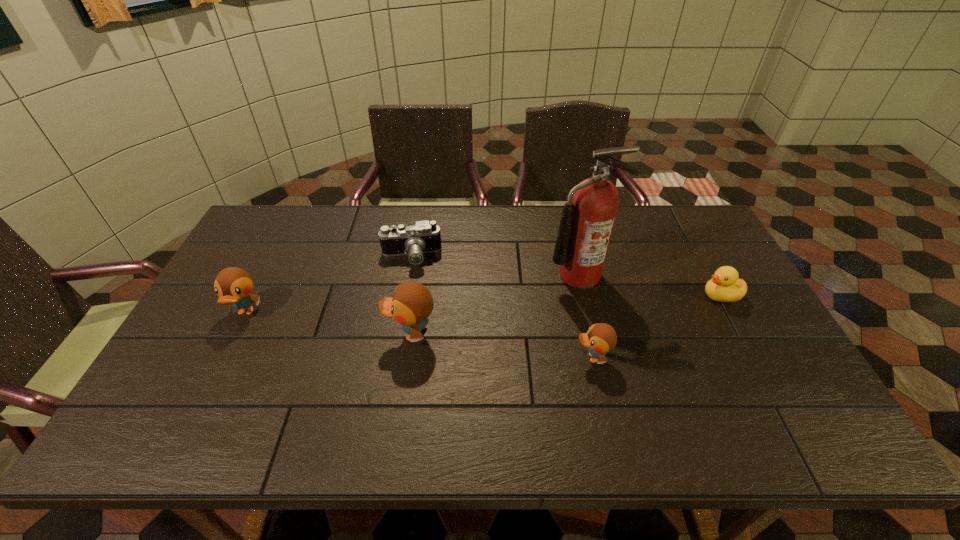
At what (x,y) coordinates should I click in order to perform the action: click on free point that satisfies the following two spatial constraints: 1. at the beak of the rightmost object; 2. on the front-facing side of the third shortest duck. Please return your answer as a coordinate pair (x, y). Looking at the image, I should click on (730, 313).